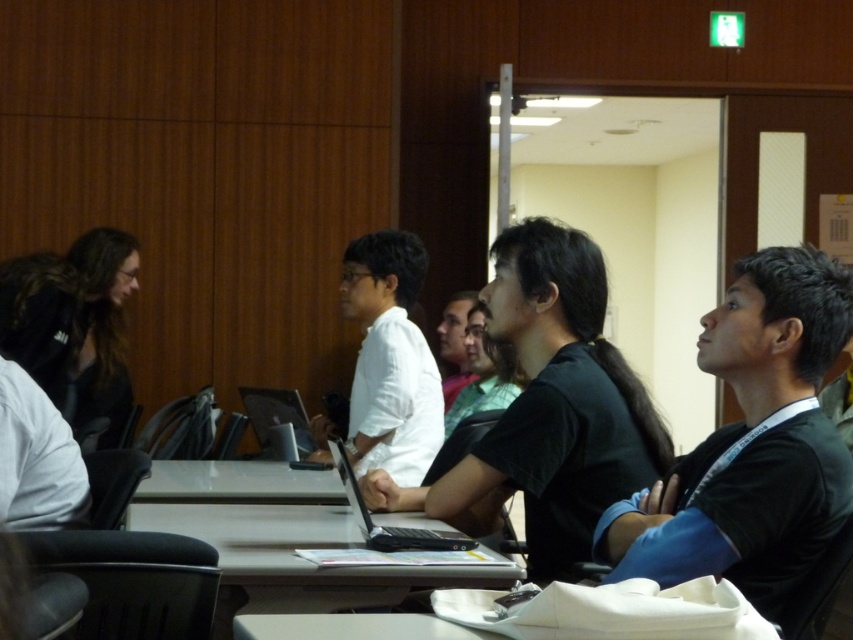
Based on the photo, is black matte shirt at center bigger than black glossy laptop at center?

Yes.

Is point (457, 486) positioned after point (351, 506)?

Yes, point (457, 486) is behind point (351, 506).

The width and height of the screenshot is (853, 640). I want to click on black matte shirt at center, so click(548, 406).